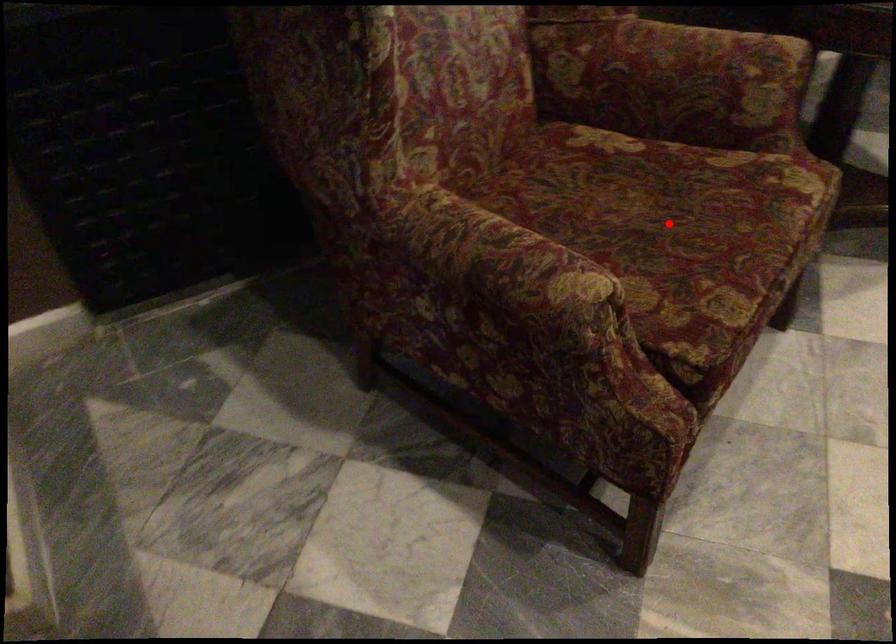
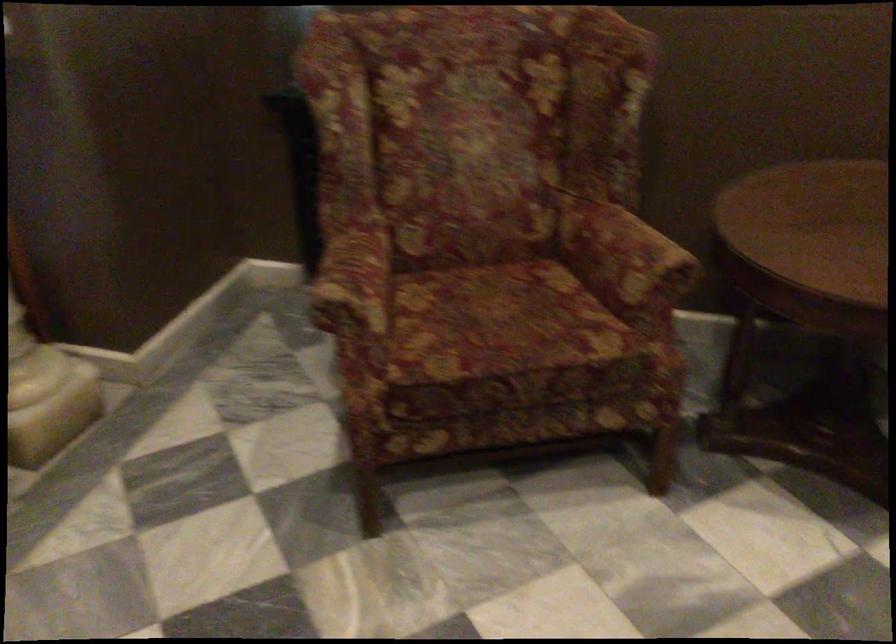
Question: I am providing you with two images of the same scene from different viewpoints. A red point is shown in image1. For the corresponding object point in image2, is it positioned nearer or farther from the camera?

Choices:
 (A) Nearer
 (B) Farther

Answer: (B)